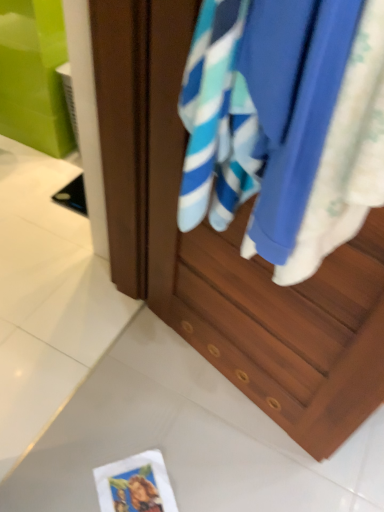
Question: Considering the relative sizes of white paper postcard at lower center and wooden cabinet at center in the image provided, is white paper postcard at lower center shorter than wooden cabinet at center?

Choices:
 (A) yes
 (B) no

Answer: (A)

Question: Considering the relative sizes of white paper postcard at lower center and wooden cabinet at center in the image provided, is white paper postcard at lower center taller than wooden cabinet at center?

Choices:
 (A) no
 (B) yes

Answer: (A)

Question: Considering the relative sizes of white paper postcard at lower center and wooden cabinet at center in the image provided, is white paper postcard at lower center bigger than wooden cabinet at center?

Choices:
 (A) no
 (B) yes

Answer: (A)

Question: Is the position of white paper postcard at lower center less distant than that of wooden cabinet at center?

Choices:
 (A) yes
 (B) no

Answer: (B)

Question: Is wooden cabinet at center inside white paper postcard at lower center?

Choices:
 (A) yes
 (B) no

Answer: (B)

Question: Considering the relative positions of wooden cabinet at center and blue cotton towel at center in the image provided, is wooden cabinet at center to the left or to the right of blue cotton towel at center?

Choices:
 (A) left
 (B) right

Answer: (B)

Question: Considering the positions of wooden cabinet at center and blue cotton towel at center in the image, is wooden cabinet at center wider or thinner than blue cotton towel at center?

Choices:
 (A) wide
 (B) thin

Answer: (B)

Question: From a real-world perspective, is wooden cabinet at center physically located above or below blue cotton towel at center?

Choices:
 (A) below
 (B) above

Answer: (A)

Question: From the image's perspective, is wooden cabinet at center positioned above or below blue cotton towel at center?

Choices:
 (A) below
 (B) above

Answer: (A)

Question: Is white paper postcard at lower center inside or outside of wooden cabinet at center?

Choices:
 (A) inside
 (B) outside

Answer: (B)

Question: From the image's perspective, is white paper postcard at lower center located above or below wooden cabinet at center?

Choices:
 (A) below
 (B) above

Answer: (A)

Question: In terms of size, does white paper postcard at lower center appear bigger or smaller than wooden cabinet at center?

Choices:
 (A) small
 (B) big

Answer: (A)

Question: Is white paper postcard at lower center taller or shorter than wooden cabinet at center?

Choices:
 (A) tall
 (B) short

Answer: (B)

Question: Looking at their shapes, would you say blue cotton towel at center is wider or thinner than white paper postcard at lower center?

Choices:
 (A) thin
 (B) wide

Answer: (A)

Question: In terms of height, does blue cotton towel at center look taller or shorter compared to white paper postcard at lower center?

Choices:
 (A) short
 (B) tall

Answer: (B)